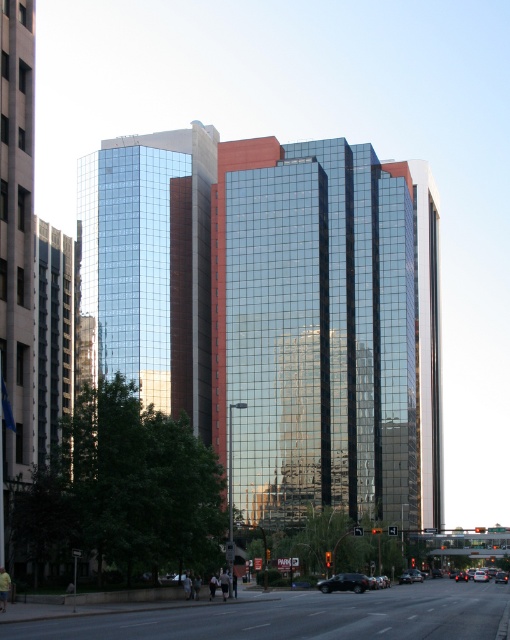
Question: Which object is closer to the camera taking this photo?

Choices:
 (A) shiny black sedan at center
 (B) glossy glass building at center

Answer: (A)

Question: Does shiny black sedan at center have a larger size compared to metallic silver sedan at center?

Choices:
 (A) yes
 (B) no

Answer: (B)

Question: Which of the following is the closest to the observer?

Choices:
 (A) metallic silver sedan at center
 (B) glossy glass building at center

Answer: (B)

Question: Is shiny black sedan at center thinner than metallic silver sedan at center?

Choices:
 (A) no
 (B) yes

Answer: (B)

Question: Among these objects, which one is nearest to the camera?

Choices:
 (A) glossy glass building at center
 (B) shiny black sedan at center
 (C) metallic silver sedan at center

Answer: (B)

Question: Is glossy glass building at center positioned behind metallic silver sedan at center?

Choices:
 (A) yes
 (B) no

Answer: (B)